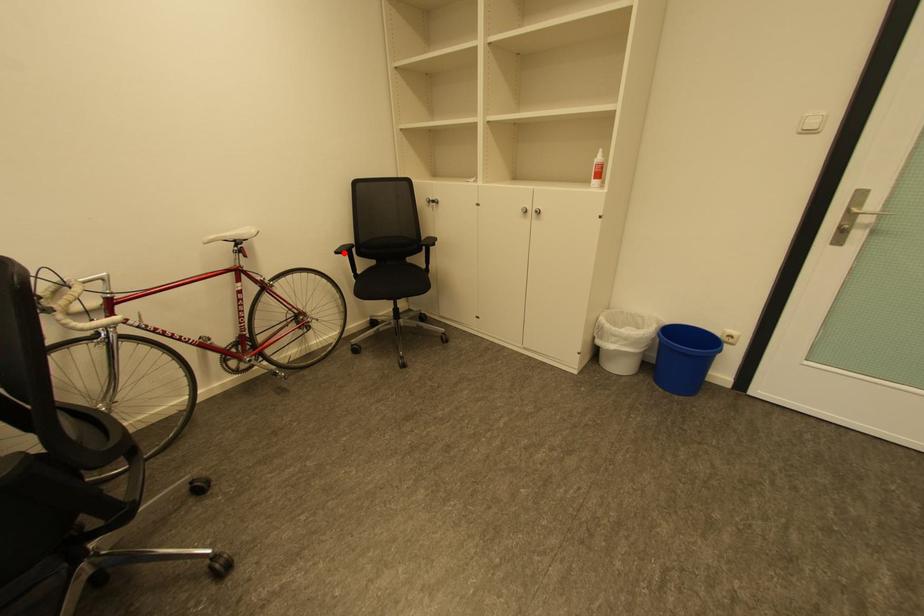
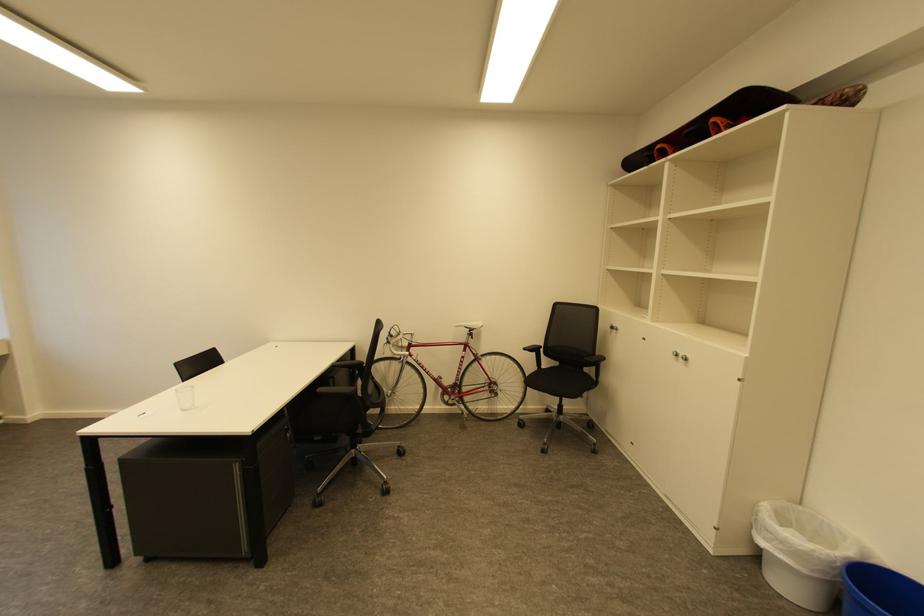
Find the pixel in the second image that matches the highlighted location in the first image.

(531, 350)